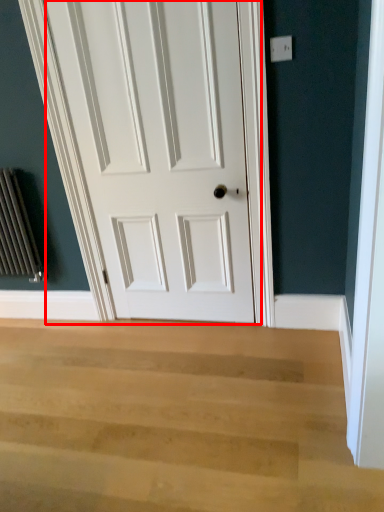
Question: From the image, what is the correct spatial relationship of door (annotated by the red box) in relation to stairwell?

Choices:
 (A) right
 (B) left

Answer: (A)